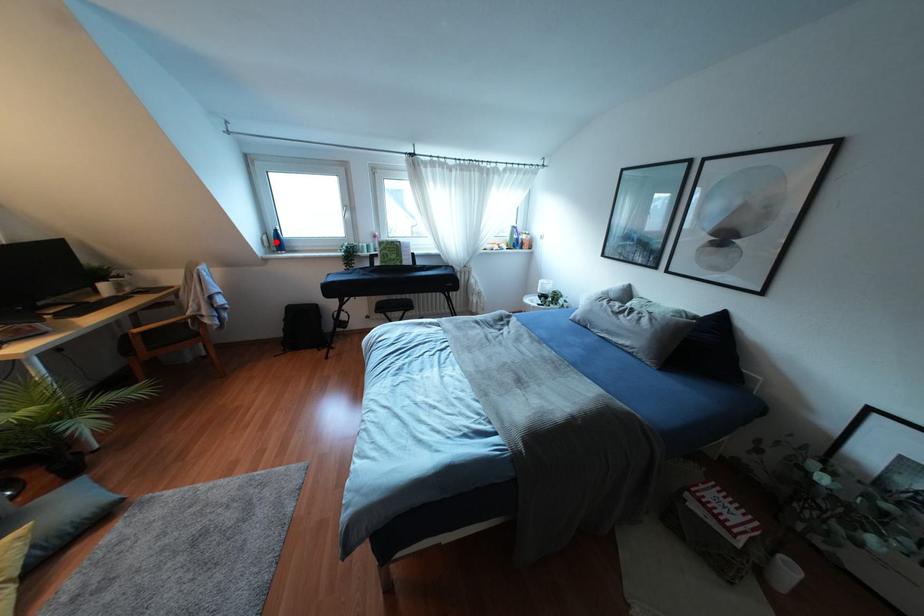
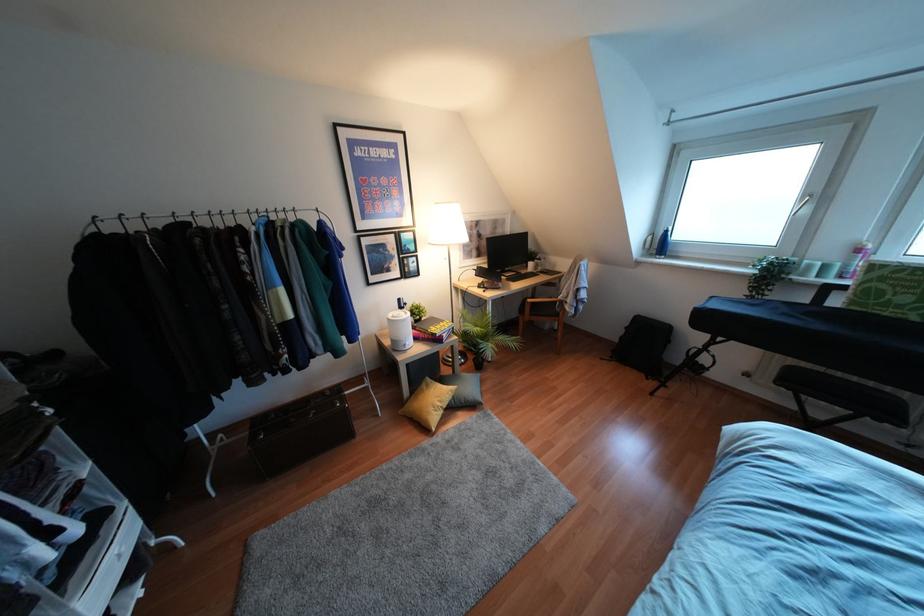
Where in the second image is the point corresponding to the highlighted location from the first image?

(660, 245)